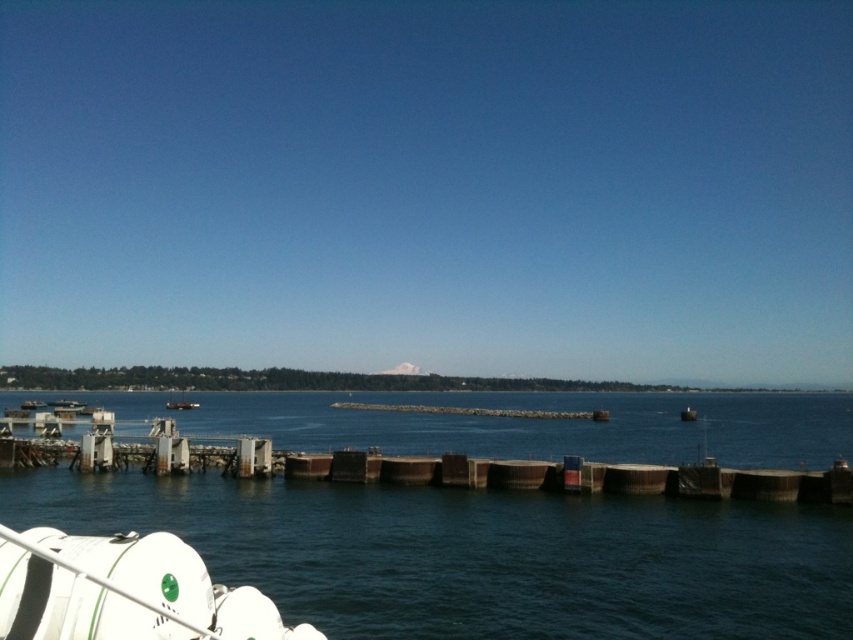
Is the position of white matte lifeboat at lower left less distant than that of smooth gray buoy at center?

Yes, it is in front of smooth gray buoy at center.

Can you confirm if white matte lifeboat at lower left is taller than smooth gray buoy at center?

Incorrect, white matte lifeboat at lower left's height is not larger of smooth gray buoy at center's.

Does point (3, 556) lie behind point (695, 416)?

No, (3, 556) is closer to viewer.

I want to click on white matte lifeboat at lower left, so click(x=125, y=592).

Looking at this image, is the position of dark blue water at center more distant than that of smooth gray buoy at center?

No, dark blue water at center is closer to the viewer.

Between point (488, 397) and point (680, 413), which one is positioned in front?

Positioned in front is point (680, 413).

Identify the location of dark blue water at center. (485, 556).

Who is higher up, dark blue water at center or white matte lifeboat at lower left?

white matte lifeboat at lower left is higher up.

Does dark blue water at center appear under white matte lifeboat at lower left?

Correct, dark blue water at center is located below white matte lifeboat at lower left.

Measure the distance between dark blue water at center and camera.

They are 20.70 meters apart.

This screenshot has height=640, width=853. What are the coordinates of `dark blue water at center` in the screenshot? It's located at (485, 556).